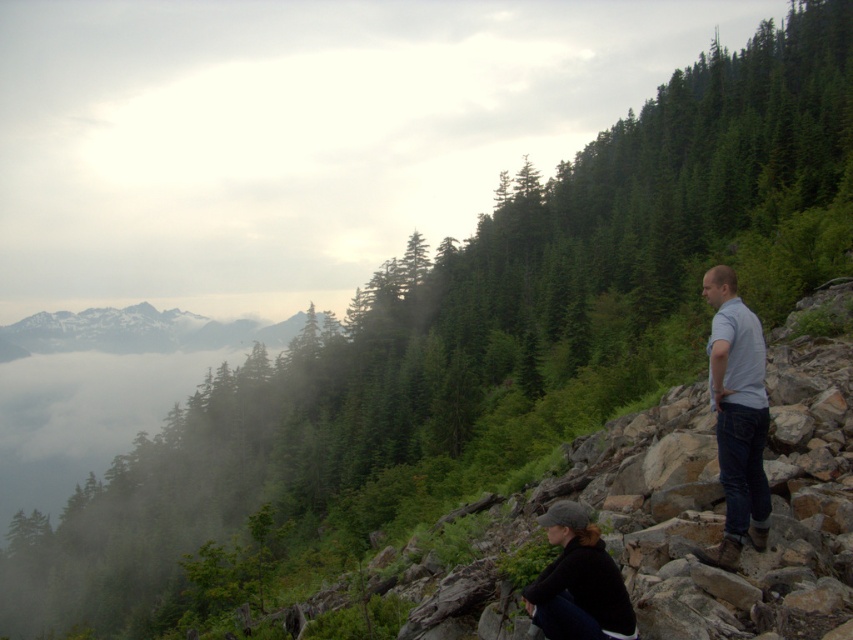
Who is more distant from viewer, (x=721, y=358) or (x=138, y=349)?

The point (x=138, y=349) is behind.

Does light blue denim jeans at right appear on the right side of snowy rock mountain at upper left?

Indeed, light blue denim jeans at right is positioned on the right side of snowy rock mountain at upper left.

Image resolution: width=853 pixels, height=640 pixels. In order to click on light blue denim jeans at right in this screenshot , I will do `click(737, 417)`.

At what (x,y) coordinates should I click in order to perform the action: click on light blue denim jeans at right. Please return your answer as a coordinate pair (x, y). Looking at the image, I should click on click(x=737, y=417).

In the scene shown: Between light blue denim jeans at right and dark gray woolen cap at lower center, which one appears on the left side from the viewer's perspective?

Positioned to the left is dark gray woolen cap at lower center.

Can you confirm if light blue denim jeans at right is taller than dark gray woolen cap at lower center?

Correct, light blue denim jeans at right is much taller as dark gray woolen cap at lower center.

The image size is (853, 640). Identify the location of light blue denim jeans at right. (737, 417).

I want to click on light blue denim jeans at right, so click(x=737, y=417).

Is snowy rock mountain at upper left wider than dark gray woolen cap at lower center?

Indeed, snowy rock mountain at upper left has a greater width compared to dark gray woolen cap at lower center.

Can you confirm if snowy rock mountain at upper left is thinner than dark gray woolen cap at lower center?

In fact, snowy rock mountain at upper left might be wider than dark gray woolen cap at lower center.

Identify the location of snowy rock mountain at upper left. (136, 332).